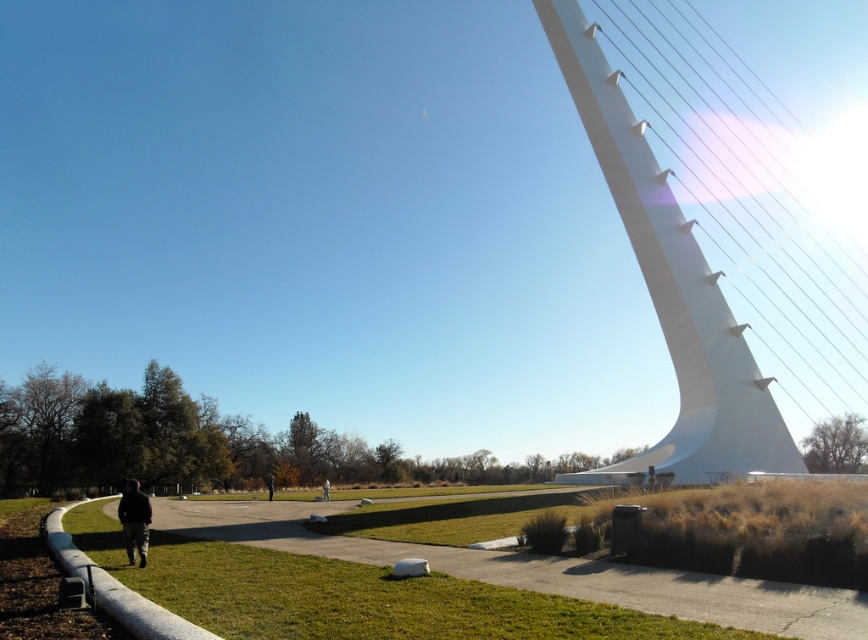
Question: Can you confirm if white smooth suspension bridge at right is positioned to the left of gray fabric person at center?

Choices:
 (A) yes
 (B) no

Answer: (B)

Question: Which object is farther from the camera taking this photo?

Choices:
 (A) white smooth suspension bridge at right
 (B) gray fabric person at center
 (C) black matte jacket at lower left

Answer: (B)

Question: Can you confirm if concrete at lower left is positioned to the right of gray fabric person at center?

Choices:
 (A) yes
 (B) no

Answer: (A)

Question: Which of the following is the closest to the observer?

Choices:
 (A) concrete at lower left
 (B) white smooth suspension bridge at right

Answer: (A)

Question: Is white smooth suspension bridge at right to the left of gray fabric person at center from the viewer's perspective?

Choices:
 (A) yes
 (B) no

Answer: (B)

Question: Which of the following is the closest to the observer?

Choices:
 (A) gray fabric person at center
 (B) black matte jacket at lower left
 (C) concrete at lower left

Answer: (C)